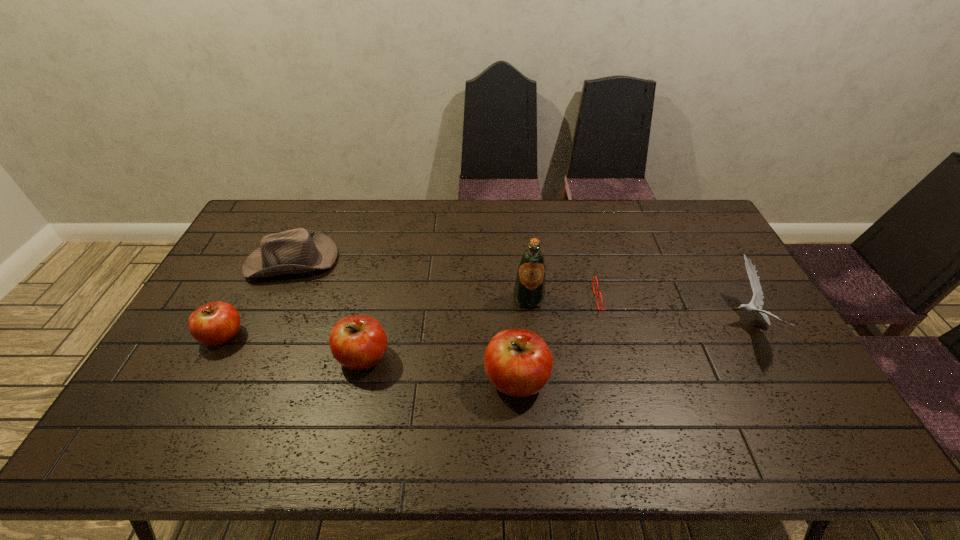
Identify the location of apple identified as the closest to the rightmost apple. This screenshot has height=540, width=960. (358, 342).

Identify the location of free location that satisfies the following two spatial constraints: 1. on the front-facing side of the shortest object; 2. on the front side of the second apple from left to right. This screenshot has height=540, width=960. (635, 357).